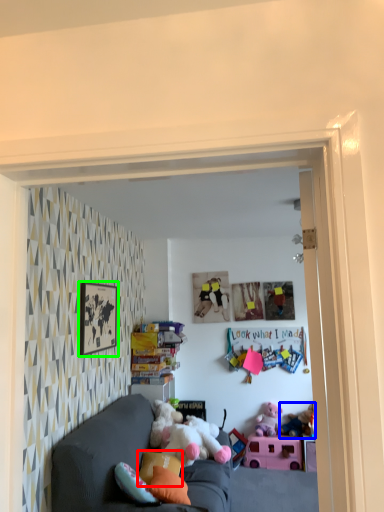
Question: Estimate the real-world distances between objects in this image. Which object is closer to pillow (highlighted by a red box), toy (highlighted by a blue box) or picture frame (highlighted by a green box)?

Choices:
 (A) toy
 (B) picture frame

Answer: (B)